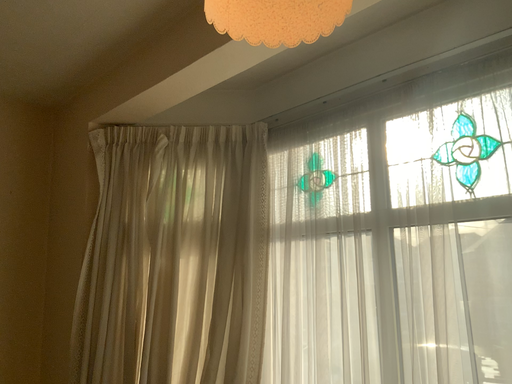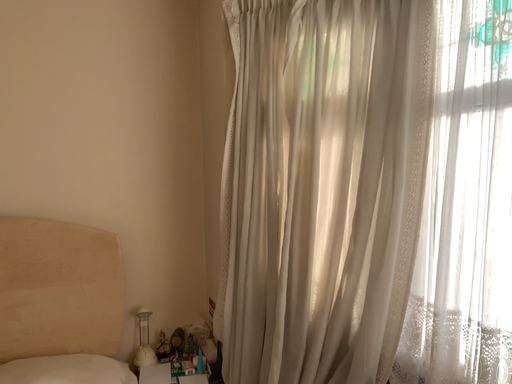
Question: Which way did the camera rotate in the video?

Choices:
 (A) rotated downward
 (B) rotated upward

Answer: (A)